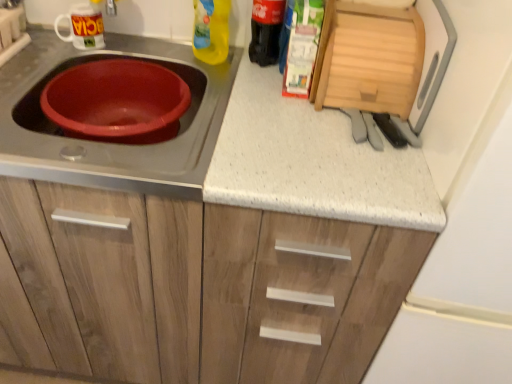
This screenshot has width=512, height=384. Identify the location of spots to the right of yellow plastic bottle at upper center, the 1th bottle viewed from the left. (251, 72).